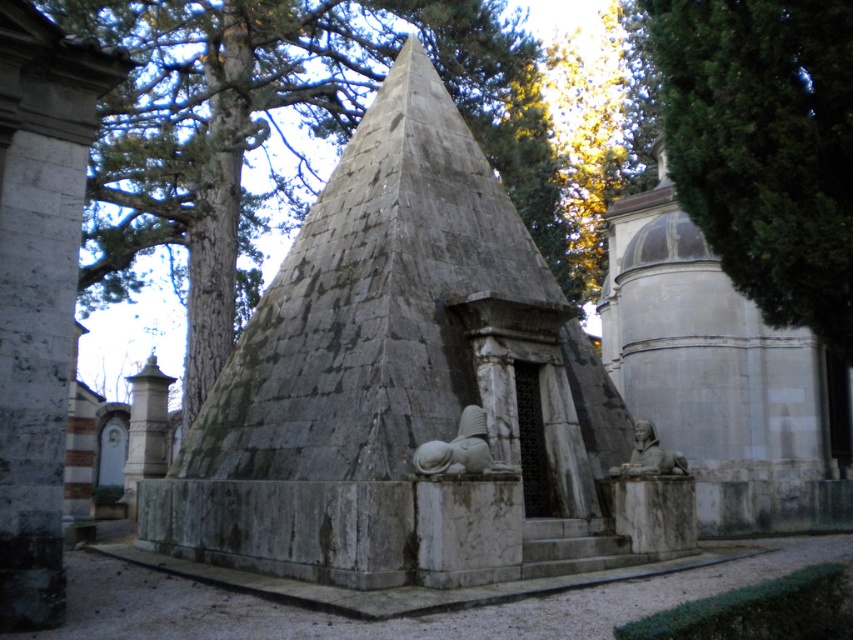
Which is behind, point (848, 13) or point (454, 449)?

The point (454, 449) is more distant.

Between green leafy tree at upper right and gray stone lion at center, which one has more height?

With more height is green leafy tree at upper right.

Describe the element at coordinates (764, 147) in the screenshot. This screenshot has width=853, height=640. I see `green leafy tree at upper right` at that location.

Find the location of `green leafy tree at upper right`. green leafy tree at upper right is located at coordinates (764, 147).

Looking at this image, is green textured tree at center smaller than gray stone sphinx at lower right?

No.

Can you confirm if green textured tree at center is shorter than gray stone sphinx at lower right?

Incorrect, green textured tree at center's height does not fall short of gray stone sphinx at lower right's.

What do you see at coordinates (277, 129) in the screenshot?
I see `green textured tree at center` at bounding box center [277, 129].

The height and width of the screenshot is (640, 853). Find the location of `green textured tree at center`. green textured tree at center is located at coordinates (277, 129).

Which is more to the left, gray stone pyramid at center or gray stone sphinx at lower right?

gray stone pyramid at center

Is point (196, 529) closer to viewer compared to point (653, 460)?

That is True.

Find the location of `gray stone pyramid at center`. gray stone pyramid at center is located at coordinates pos(410,388).